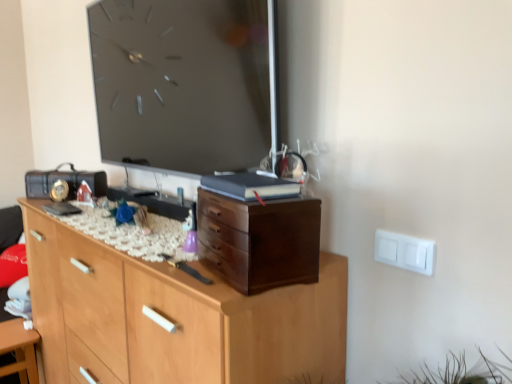
Question: From a real-world perspective, is wooden chest of drawers at center, the first chest of drawers ordered from the bottom, physically located above or below dark wood chest of drawers at center, placed as the 1th chest of drawers when sorted from top to bottom?

Choices:
 (A) above
 (B) below

Answer: (B)

Question: In terms of size, does wooden chest of drawers at center, arranged as the second chest of drawers when viewed from the top, appear bigger or smaller than dark wood chest of drawers at center, placed as the 1th chest of drawers when sorted from top to bottom?

Choices:
 (A) big
 (B) small

Answer: (A)

Question: Based on their relative distances, which object is farther from the dark wood chest of drawers at center, placed as the 1th chest of drawers when sorted from top to bottom?

Choices:
 (A) white glossy table at lower left
 (B) wooden chest of drawers at center, arranged as the second chest of drawers when viewed from the top

Answer: (A)

Question: Estimate the real-world distances between objects in this image. Which object is farther from the white glossy table at lower left?

Choices:
 (A) dark wood chest of drawers at center, which appears as the second chest of drawers when ordered from the bottom
 (B) wooden chest of drawers at center, arranged as the second chest of drawers when viewed from the top

Answer: (A)